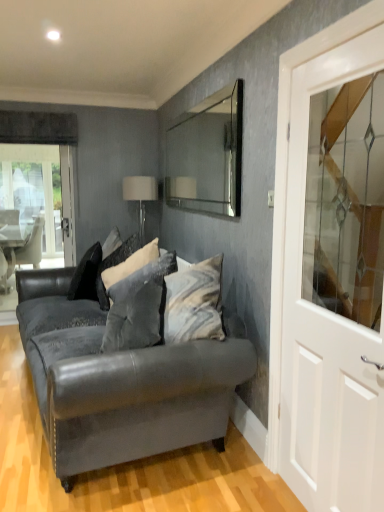
Question: Is white fabric lampshade at upper center to the right of clear glass mirror at upper center from the viewer's perspective?

Choices:
 (A) no
 (B) yes

Answer: (A)

Question: Is white fabric lampshade at upper center at the left side of clear glass mirror at upper center?

Choices:
 (A) yes
 (B) no

Answer: (A)

Question: Can you confirm if white fabric lampshade at upper center is bigger than clear glass mirror at upper center?

Choices:
 (A) no
 (B) yes

Answer: (B)

Question: Does white fabric lampshade at upper center have a smaller size compared to clear glass mirror at upper center?

Choices:
 (A) yes
 (B) no

Answer: (B)

Question: Is white fabric lampshade at upper center closer to the viewer compared to clear glass mirror at upper center?

Choices:
 (A) no
 (B) yes

Answer: (A)

Question: Considering the positions of velvet dark gray couch at center and velvet gray pillow at center, arranged as the 3th pillow when viewed from the back, in the image, is velvet dark gray couch at center wider or thinner than velvet gray pillow at center, arranged as the 3th pillow when viewed from the back,?

Choices:
 (A) thin
 (B) wide

Answer: (B)

Question: In the image, is velvet dark gray couch at center positioned in front of or behind velvet gray pillow at center, arranged as the 3th pillow when viewed from the back?

Choices:
 (A) behind
 (B) front

Answer: (B)

Question: From the image's perspective, is velvet dark gray couch at center located above or below velvet gray pillow at center, arranged as the first pillow when viewed from the front?

Choices:
 (A) above
 (B) below

Answer: (B)

Question: Does point (102, 418) appear closer or farther from the camera than point (120, 303)?

Choices:
 (A) closer
 (B) farther

Answer: (A)

Question: Looking at the image, does velvet gray pillow at center, placed as the second pillow when sorted from back to front, seem bigger or smaller compared to white fabric lampshade at upper center?

Choices:
 (A) big
 (B) small

Answer: (A)

Question: From the image's perspective, is velvet gray pillow at center, arranged as the 2th pillow when viewed from the front, above or below white fabric lampshade at upper center?

Choices:
 (A) above
 (B) below

Answer: (B)

Question: Is velvet gray pillow at center, arranged as the 2th pillow when viewed from the front, spatially inside white fabric lampshade at upper center, or outside of it?

Choices:
 (A) outside
 (B) inside

Answer: (A)

Question: From a real-world perspective, is velvet gray pillow at center, placed as the second pillow when sorted from back to front, above or below white fabric lampshade at upper center?

Choices:
 (A) below
 (B) above

Answer: (A)

Question: From the image's perspective, is velvet gray pillow at center, arranged as the first pillow when viewed from the front, positioned above or below white fabric lampshade at upper center?

Choices:
 (A) below
 (B) above

Answer: (A)

Question: Is point [114, 297] positioned closer to the camera than point [127, 190]?

Choices:
 (A) closer
 (B) farther

Answer: (A)